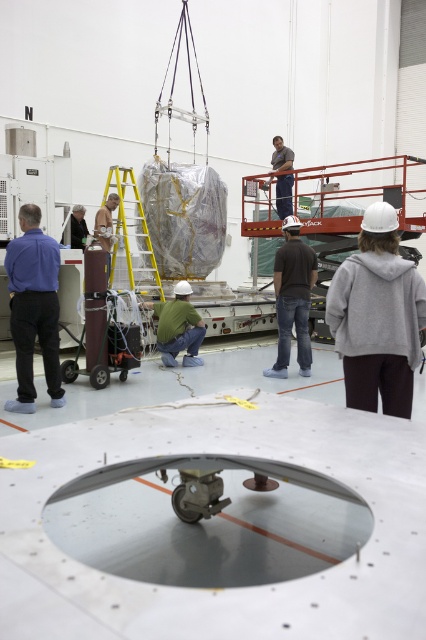
The height and width of the screenshot is (640, 426). I want to click on matte blue shirt at left, so click(x=34, y=308).

Between point (54, 275) and point (138, 227), which one is positioned in front?

Point (54, 275)

Who is more forward, (57, 372) or (115, 182)?

Point (57, 372) is in front.

You are a GUI agent. You are given a task and a screenshot of the screen. Output one action in this format:
    pyautogui.click(x=<x>, y=<y>)
    Task: Click on the matte blue shirt at left
    
    Given the screenshot: What is the action you would take?
    pyautogui.click(x=34, y=308)

Who is higher up, matte blue shirt at left or dark gray shirt at center?

Positioned higher is dark gray shirt at center.

Who is lower down, matte blue shirt at left or dark gray shirt at center?

matte blue shirt at left is below.

Identify the location of matte blue shirt at left. (34, 308).

Can you confirm if dark gray shirt at center is positioned above yellow/yellowish metal ladder at center?

No.

Between point (279, 320) and point (149, 269), which one is positioned in front?

Positioned in front is point (279, 320).

This screenshot has height=640, width=426. What do you see at coordinates (293, 298) in the screenshot? I see `dark gray shirt at center` at bounding box center [293, 298].

Where is `dark gray shirt at center`? Image resolution: width=426 pixels, height=640 pixels. dark gray shirt at center is located at coordinates (293, 298).